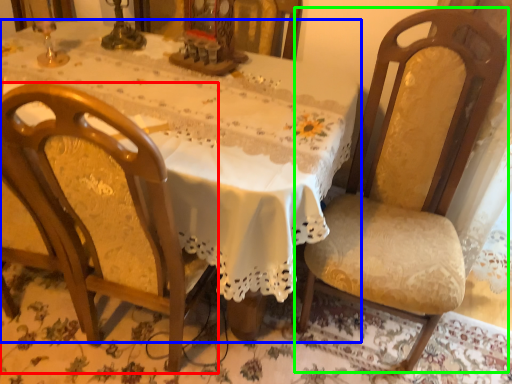
Question: Based on their relative distances, which object is nearer to chair (highlighted by a red box)? Choose from table (highlighted by a blue box) and chair (highlighted by a green box).

Choices:
 (A) table
 (B) chair

Answer: (A)